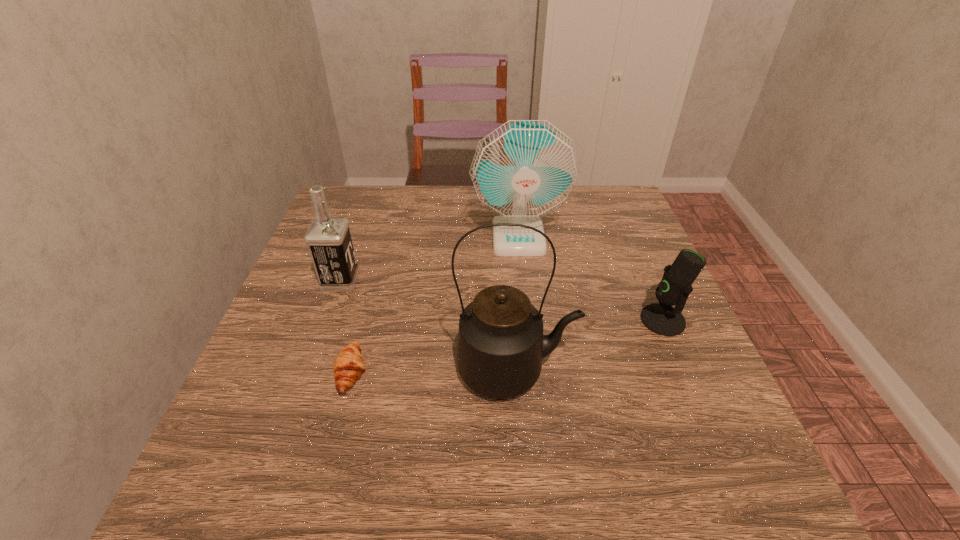
Identify the location of vacant space at the right edge. This screenshot has height=540, width=960. (617, 280).

In the image, there is a desktop. At what (x,y) coordinates should I click in order to perform the action: click on vacant space at the far left corner. Please return your answer as a coordinate pair (x, y). The width and height of the screenshot is (960, 540). Looking at the image, I should click on point(337,193).

In the image, there is a desktop. Where is `vacant area at the far right corner`? The height and width of the screenshot is (540, 960). vacant area at the far right corner is located at coordinates (628, 199).

In the image, there is a desktop. Where is `vacant space at the near right corner`? The image size is (960, 540). vacant space at the near right corner is located at coordinates (781, 517).

Find the location of a particular element. Image resolution: width=960 pixels, height=540 pixels. vacant region between the vodka and the farthest object is located at coordinates (429, 259).

Locate an element on the screen. Image resolution: width=960 pixels, height=540 pixels. empty space that is in between the fan and the third shortest object is located at coordinates (429, 259).

This screenshot has height=540, width=960. I want to click on empty space between the farthest object and the fourth nearest object, so click(429, 259).

I want to click on blank region between the fourth object from right to left and the second farthest object, so click(x=346, y=327).

The width and height of the screenshot is (960, 540). Find the location of `free spot between the kettle and the leftmost object`. free spot between the kettle and the leftmost object is located at coordinates (428, 326).

The width and height of the screenshot is (960, 540). What are the coordinates of `free space between the kettle and the pastry` in the screenshot? It's located at (433, 371).